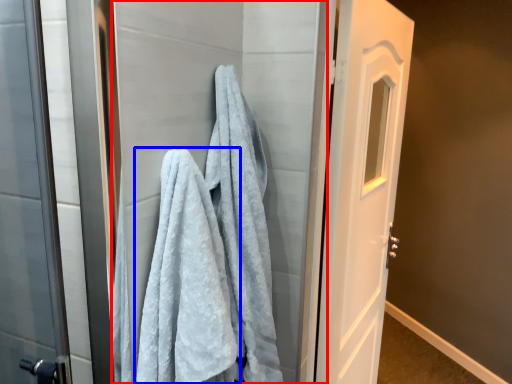
Question: Which point is closer to the camera, screen door (highlighted by a red box) or towel (highlighted by a blue box)?

Choices:
 (A) screen door
 (B) towel

Answer: (B)